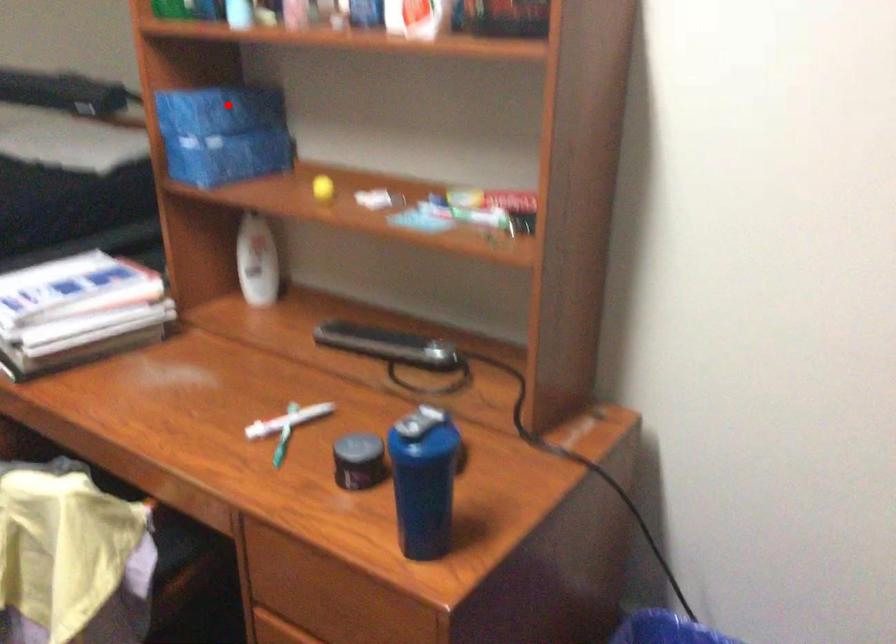
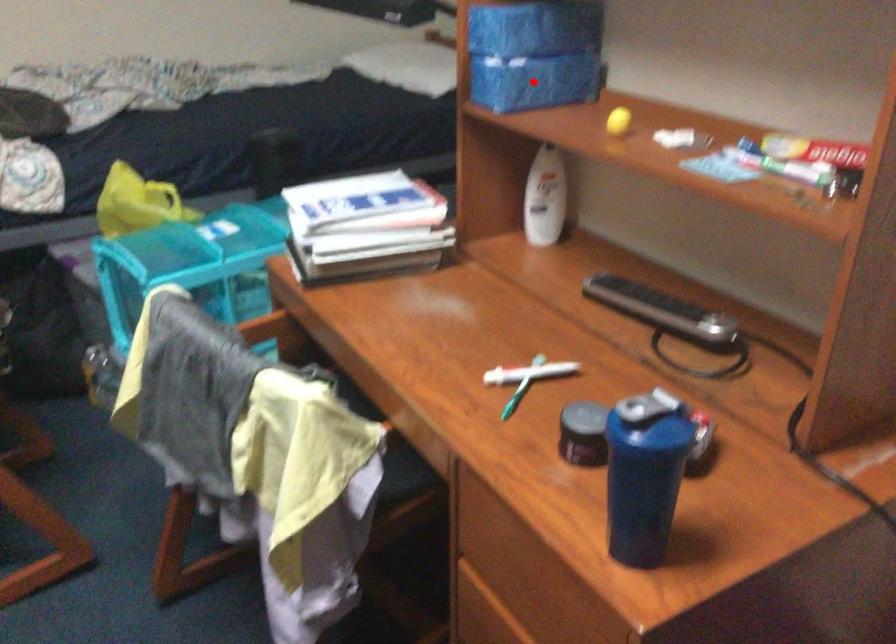
I am providing you with two images of the same scene from different viewpoints. A red point is marked on the first image and another point is marked on the second image. Is the marked point in image1 the same physical position as the marked point in image2?

No